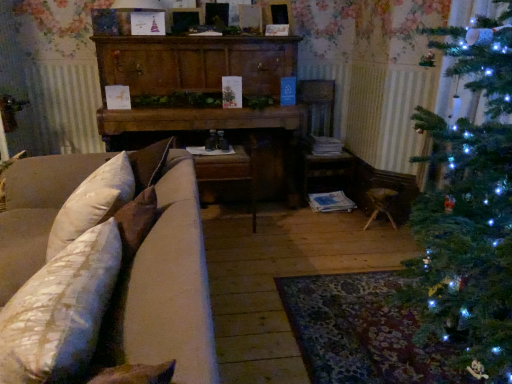
You are a GUI agent. You are given a task and a screenshot of the screen. Output one action in this format:
    pyautogui.click(x=<x>, y=<y>)
    Task: Click on the white textured pillow at lower left
    Image resolution: width=512 pixels, height=384 pixels.
    Given the screenshot: What is the action you would take?
    pyautogui.click(x=60, y=311)

What do you see at coordinates (60, 311) in the screenshot? This screenshot has width=512, height=384. I see `white textured pillow at lower left` at bounding box center [60, 311].

Describe the element at coordinates (322, 141) in the screenshot. I see `wooden armchair at center` at that location.

What do you see at coordinates (204, 100) in the screenshot? I see `wooden dresser at center` at bounding box center [204, 100].

The width and height of the screenshot is (512, 384). What are the coordinates of `white textured pillow at lower left` in the screenshot? It's located at (60, 311).

Considering the sizes of objects white textured pillow at lower left and wooden dresser at center in the image provided, who is bigger, white textured pillow at lower left or wooden dresser at center?

Bigger between the two is wooden dresser at center.

From the image's perspective, between white textured pillow at lower left and wooden dresser at center, which one is located above?

wooden dresser at center, from the image's perspective.

Does white textured pillow at lower left appear on the left side of wooden dresser at center?

Yes, white textured pillow at lower left is to the left of wooden dresser at center.

How different are the orientations of white textured pillow at lower left and wooden dresser at center in degrees?

The angle between the facing direction of white textured pillow at lower left and the facing direction of wooden dresser at center is 90.7 degrees.

Is wooden armchair at center with white textured pillow at lower left?

No, wooden armchair at center is not next to white textured pillow at lower left.

Measure the distance from wooden armchair at center to white textured pillow at lower left.

A distance of 2.36 meters exists between wooden armchair at center and white textured pillow at lower left.

From a real-world perspective, between wooden armchair at center and white textured pillow at lower left, who is vertically lower?

wooden armchair at center.

Is the depth of wooden armchair at center less than that of white textured pillow at lower left?

No, the depth of wooden armchair at center is greater than that of white textured pillow at lower left.

From a real-world perspective, which is physically below, wooden dresser at center or white textured pillow at lower left?

From a 3D spatial view, wooden dresser at center is below.

Considering the relative sizes of wooden dresser at center and white textured pillow at lower left in the image provided, is wooden dresser at center shorter than white textured pillow at lower left?

No.

In the image, is wooden dresser at center on the left side or the right side of white textured pillow at lower left?

wooden dresser at center is to the right of white textured pillow at lower left.

Is white textured pillow at lower left located within wooden dresser at center?

That's incorrect, white textured pillow at lower left is not inside wooden dresser at center.

From a real-world perspective, is wooden dresser at center on beige fabric couch at left?

Correct, in the physical world, wooden dresser at center is higher than beige fabric couch at left.

Which of these two, wooden dresser at center or beige fabric couch at left, is thinner?

wooden dresser at center.

Locate an element on the screen. dresser located behind the beige fabric couch at left is located at coordinates (204, 100).

Is wooden dresser at center not near beige fabric couch at left?

That's right, there is a large distance between wooden dresser at center and beige fabric couch at left.

Could you tell me if beige fabric couch at left is facing wooden armchair at center?

No, beige fabric couch at left is not facing towards wooden armchair at center.

Is beige fabric couch at left behind wooden armchair at center?

No, the depth of beige fabric couch at left is less than that of wooden armchair at center.

Between beige fabric couch at left and wooden armchair at center, which one has more height?

wooden armchair at center.

In terms of width, does beige fabric couch at left look wider or thinner when compared to wooden armchair at center?

Considering their sizes, beige fabric couch at left looks broader than wooden armchair at center.

Between point (332, 106) and point (229, 130), which one is positioned behind?

Positioned behind is point (332, 106).

Between wooden armchair at center and wooden dresser at center, which one appears on the right side from the viewer's perspective?

wooden armchair at center is more to the right.

Is wooden armchair at center next to wooden dresser at center?

No, wooden armchair at center is not with wooden dresser at center.

From a real-world perspective, is wooden armchair at center over wooden dresser at center?

No, from a real-world perspective, wooden armchair at center is not over wooden dresser at center

From a real-world perspective, relative to wooden armchair at center, is wooden dresser at center vertically above or below?

wooden dresser at center is situated higher than wooden armchair at center in the real world.

Is wooden dresser at center wider or thinner than wooden armchair at center?

Considering their sizes, wooden dresser at center looks broader than wooden armchair at center.

Which point is more distant from viewer, (155, 107) or (324, 182)?

The point (324, 182) is farther from the camera.

Which is more to the left, wooden dresser at center or wooden armchair at center?

Positioned to the left is wooden dresser at center.

Find the location of a particular element. This screenshot has height=384, width=512. pillow above the wooden dresser at center (from a real-world perspective) is located at coordinates (60, 311).

At what (x,y) coordinates should I click in order to perform the action: click on pillow below the wooden armchair at center (from the image's perspective). Please return your answer as a coordinate pair (x, y). The width and height of the screenshot is (512, 384). Looking at the image, I should click on (60, 311).

Which object lies nearer to the anchor point wooden dresser at center, wooden armchair at center or white textured pillow at lower left?

wooden armchair at center.

Estimate the real-world distances between objects in this image. Which object is closer to beige fabric couch at left, wooden dresser at center or wooden armchair at center?

wooden dresser at center is closer to beige fabric couch at left.

When comparing their distances from beige fabric couch at left, does wooden armchair at center or wooden dresser at center seem closer?

wooden dresser at center lies closer to beige fabric couch at left than the other object.

Which object lies further to the anchor point wooden dresser at center, white textured pillow at lower left or wooden armchair at center?

Based on the image, white textured pillow at lower left appears to be further to wooden dresser at center.

Estimate the real-world distances between objects in this image. Which object is further from wooden dresser at center, beige fabric couch at left or wooden armchair at center?

Among the two, beige fabric couch at left is located further to wooden dresser at center.

From the image, which object appears to be nearer to white textured pillow at lower left, beige fabric couch at left or wooden dresser at center?

The object closer to white textured pillow at lower left is beige fabric couch at left.

From the image, which object appears to be farther from wooden dresser at center, beige fabric couch at left or white textured pillow at lower left?

white textured pillow at lower left is further to wooden dresser at center.

Which object lies nearer to the anchor point beige fabric couch at left, white textured pillow at lower left or wooden armchair at center?

white textured pillow at lower left is closer to beige fabric couch at left.

What are the coordinates of `dresser positioned between beige fabric couch at left and wooden armchair at center from near to far` in the screenshot? It's located at (204, 100).

This screenshot has width=512, height=384. I want to click on pillow between beige fabric couch at left and wooden dresser at center from front to back, so tap(60, 311).

Find the location of `dresser between white textured pillow at lower left and wooden armchair at center along the z-axis`. dresser between white textured pillow at lower left and wooden armchair at center along the z-axis is located at coordinates (204, 100).

Locate an element on the screen. This screenshot has height=384, width=512. pillow between beige fabric couch at left and wooden armchair at center from front to back is located at coordinates (60, 311).